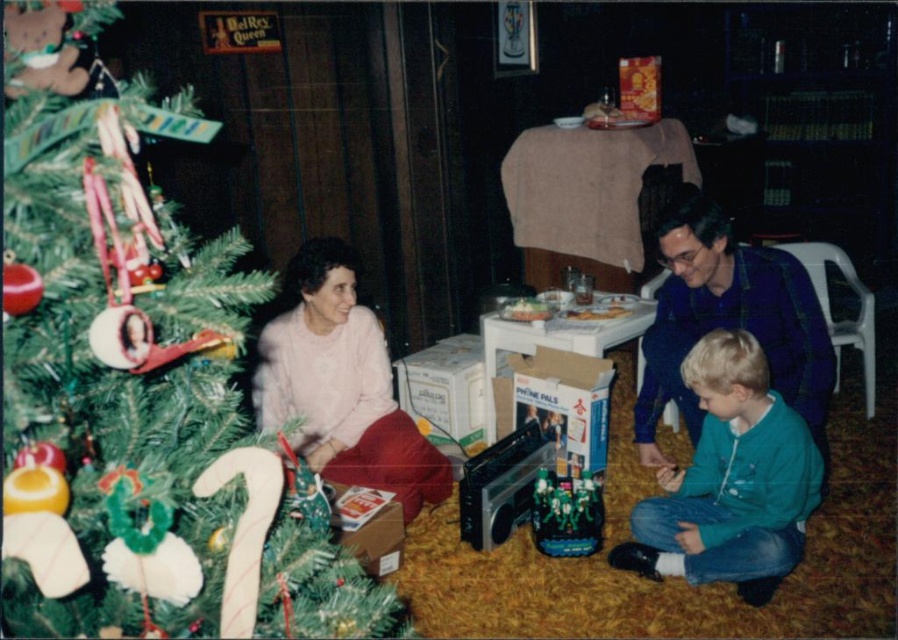
You are standing in the room and want to place a small gift under the green matte christmas tree at left. The point where you should place the gift is marked as point (137, 385). Is this point on the tree or somewhere else?

The point (137, 385) is on the green matte christmas tree at left, so you can place the gift there.

You are a guest at the holiday gathering and want to sit down. You see the teal fleece jacket at lower right and the pink fabric at lower left. Which one is closer to your right side if you face the scene?

The teal fleece jacket at lower right is to the right of the pink fabric at lower left, so it would be closer to your right side when facing the scene.

You are organizing a holiday gift exchange and need to place a small gift under the Christmas tree. The teal fleece jacket at lower right and the pink fabric at lower left are both under the tree. Which one has more space available next to it for placing the gift?

The pink fabric at lower left has more space available next to it because it is larger than the teal fleece jacket at lower right.